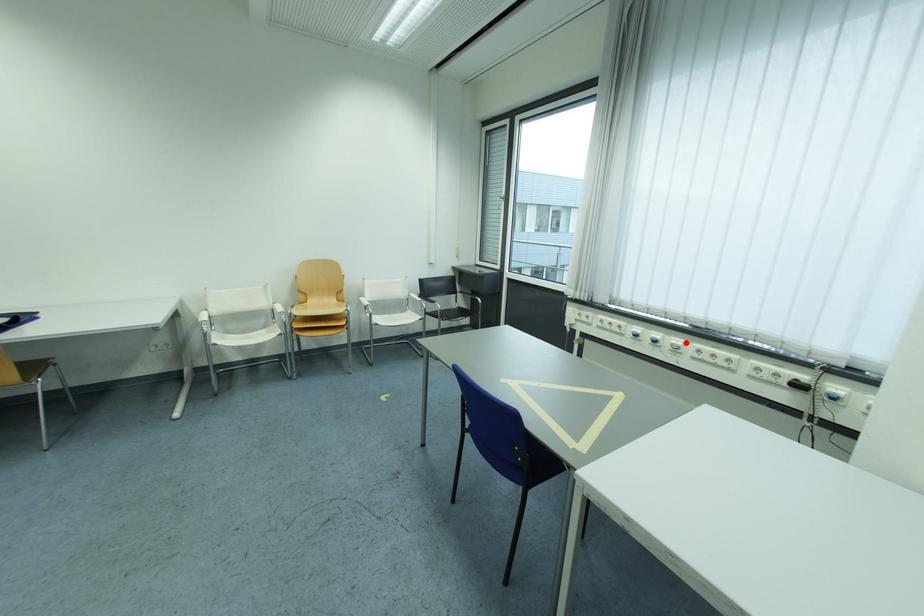
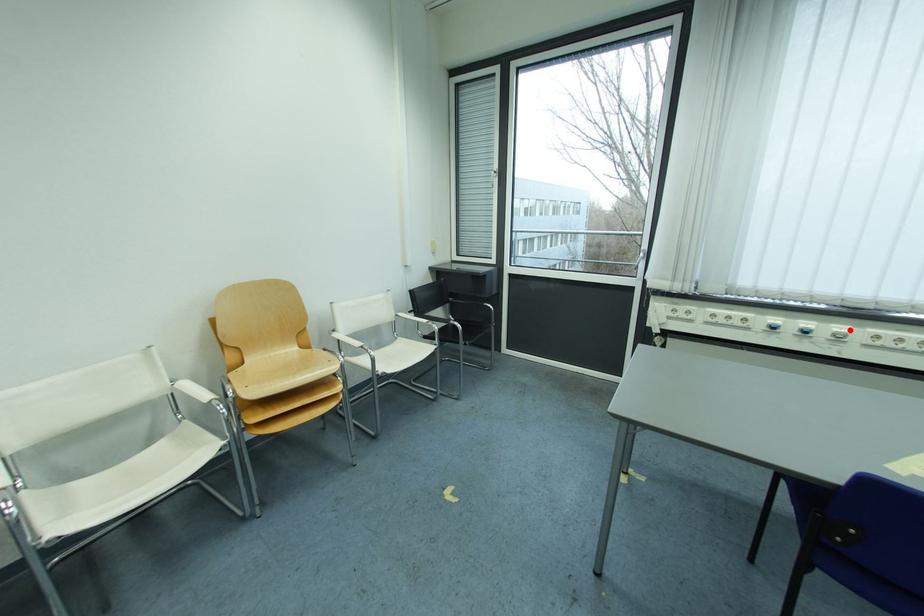
I am providing you with two images of the same scene from different viewpoints. A red point is marked on the first image and another point is marked on the second image. Does the point marked in image1 correspond to the same location as the one in image2?

Yes